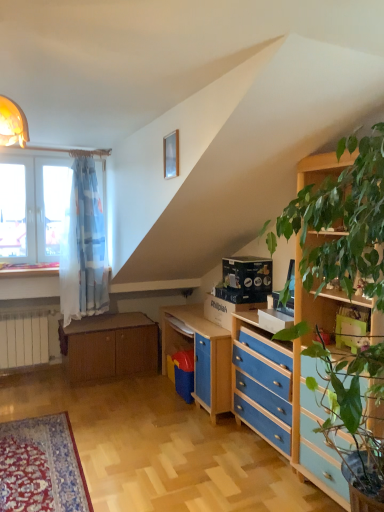
Question: Visually, is blue painted wood chest of drawers at lower right positioned to the left or to the right of wooden cabinet at lower left?

Choices:
 (A) right
 (B) left

Answer: (A)

Question: Is blue painted wood chest of drawers at lower right in front of or behind wooden cabinet at lower left in the image?

Choices:
 (A) front
 (B) behind

Answer: (A)

Question: Which is farther from the blue painted wood chest of drawers at lower right?

Choices:
 (A) wooden at left
 (B) wooden cabinet at lower left

Answer: (A)

Question: Which is farther from the blue painted wood chest of drawers at lower right?

Choices:
 (A) wooden at left
 (B) wooden cabinet at lower left

Answer: (A)